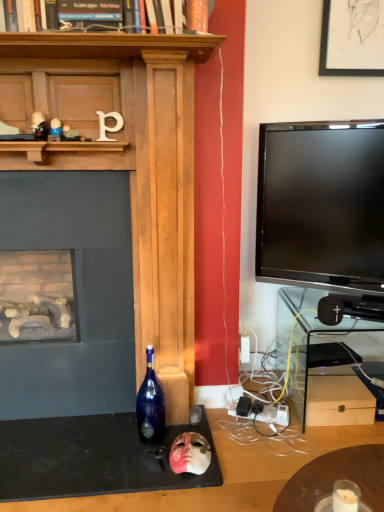
Question: Is metallic silver toy at upper center, which ranks as the third toy in top-to-bottom order, facing away from metallic black figurine at upper left, the first toy from the top?

Choices:
 (A) yes
 (B) no

Answer: (B)

Question: Is metallic silver toy at upper center, which ranks as the third toy in top-to-bottom order, wider than metallic black figurine at upper left, the first toy from the top?

Choices:
 (A) yes
 (B) no

Answer: (B)

Question: From a real-world perspective, is metallic silver toy at upper center, the 3th toy in the left-to-right sequence, on metallic black figurine at upper left, which is the fourth toy in right-to-left order?

Choices:
 (A) no
 (B) yes

Answer: (A)

Question: Considering the relative positions of metallic silver toy at upper center, the 3th toy in the left-to-right sequence, and metallic black figurine at upper left, the first toy from the top, in the image provided, is metallic silver toy at upper center, the 3th toy in the left-to-right sequence, to the right of metallic black figurine at upper left, the first toy from the top, from the viewer's perspective?

Choices:
 (A) no
 (B) yes

Answer: (B)

Question: Considering the relative sizes of metallic silver toy at upper center, the 3th toy in the left-to-right sequence, and metallic black figurine at upper left, which is the fourth toy in right-to-left order, in the image provided, is metallic silver toy at upper center, the 3th toy in the left-to-right sequence, smaller than metallic black figurine at upper left, which is the fourth toy in right-to-left order,?

Choices:
 (A) yes
 (B) no

Answer: (A)

Question: Does point (51, 129) appear closer or farther from the camera than point (327, 309)?

Choices:
 (A) farther
 (B) closer

Answer: (B)

Question: Considering the positions of plastic toy at upper left, which is the third toy from right to left, and black matte speaker at lower right in the image, is plastic toy at upper left, which is the third toy from right to left, wider or thinner than black matte speaker at lower right?

Choices:
 (A) thin
 (B) wide

Answer: (A)

Question: From the image's perspective, is plastic toy at upper left, which is the third toy from right to left, above or below black matte speaker at lower right?

Choices:
 (A) below
 (B) above

Answer: (B)

Question: Considering their positions, is plastic toy at upper left, which is the third toy from right to left, located in front of or behind black matte speaker at lower right?

Choices:
 (A) behind
 (B) front

Answer: (B)

Question: Relative to metallic silver toy at upper center, which ranks as the third toy in top-to-bottom order, is black matte speaker at lower right in front or behind?

Choices:
 (A) behind
 (B) front

Answer: (A)

Question: From a real-world perspective, relative to metallic silver toy at upper center, the second toy ordered from the bottom, is black matte speaker at lower right vertically above or below?

Choices:
 (A) below
 (B) above

Answer: (A)

Question: Is black matte speaker at lower right spatially inside metallic silver toy at upper center, which ranks as the third toy in top-to-bottom order, or outside of it?

Choices:
 (A) inside
 (B) outside

Answer: (B)

Question: Considering the positions of point (322, 301) and point (67, 126), is point (322, 301) closer or farther from the camera than point (67, 126)?

Choices:
 (A) farther
 (B) closer

Answer: (A)

Question: From a real-world perspective, is clear glass shelf at right physically located above or below black matte speaker at lower right?

Choices:
 (A) below
 (B) above

Answer: (A)

Question: Which is correct: clear glass shelf at right is inside black matte speaker at lower right, or outside of it?

Choices:
 (A) inside
 (B) outside

Answer: (B)